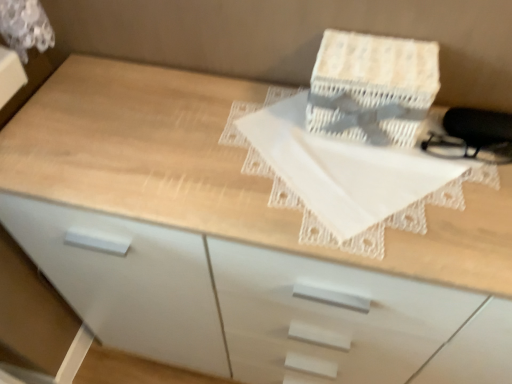
Question: Does white woven cardboard box at upper center have a greater height compared to white lace cloth at center?

Choices:
 (A) yes
 (B) no

Answer: (A)

Question: From the image's perspective, does white woven cardboard box at upper center appear higher than white lace cloth at center?

Choices:
 (A) no
 (B) yes

Answer: (B)

Question: Is white woven cardboard box at upper center directly adjacent to white lace cloth at center?

Choices:
 (A) yes
 (B) no

Answer: (A)

Question: Is white woven cardboard box at upper center far away from white lace cloth at center?

Choices:
 (A) no
 (B) yes

Answer: (A)

Question: Can we say white woven cardboard box at upper center lies outside white lace cloth at center?

Choices:
 (A) yes
 (B) no

Answer: (A)

Question: Can you confirm if white woven cardboard box at upper center is shorter than white lace cloth at center?

Choices:
 (A) no
 (B) yes

Answer: (A)

Question: Is white woven cardboard box at upper center a part of white lace cloth at center?

Choices:
 (A) no
 (B) yes

Answer: (A)

Question: Is white lace cloth at center positioned far away from white woven cardboard box at upper center?

Choices:
 (A) yes
 (B) no

Answer: (B)

Question: From a real-world perspective, is white lace cloth at center on white woven cardboard box at upper center?

Choices:
 (A) no
 (B) yes

Answer: (A)

Question: Is white lace cloth at center facing away from white woven cardboard box at upper center?

Choices:
 (A) yes
 (B) no

Answer: (A)

Question: Considering the relative positions of white lace cloth at center and white woven cardboard box at upper center in the image provided, is white lace cloth at center to the right of white woven cardboard box at upper center from the viewer's perspective?

Choices:
 (A) yes
 (B) no

Answer: (B)

Question: Is white lace cloth at center beside white woven cardboard box at upper center?

Choices:
 (A) yes
 (B) no

Answer: (A)

Question: Is white woven cardboard box at upper center spatially inside white lace cloth at center, or outside of it?

Choices:
 (A) outside
 (B) inside

Answer: (A)